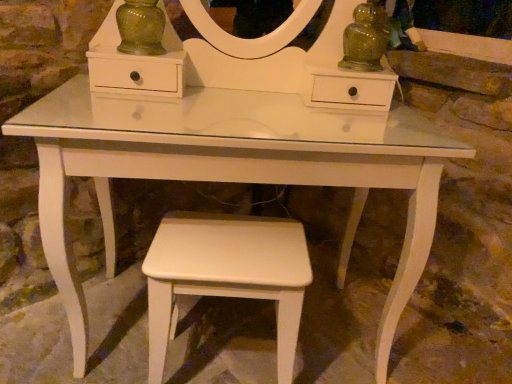
Question: Can you confirm if white matte stool at lower center is taller than green glass vase at upper left?

Choices:
 (A) yes
 (B) no

Answer: (A)

Question: Is white matte stool at lower center smaller than green glass vase at upper left?

Choices:
 (A) yes
 (B) no

Answer: (B)

Question: Is white matte stool at lower center facing towards green glass vase at upper left?

Choices:
 (A) yes
 (B) no

Answer: (B)

Question: Considering the relative positions of white matte stool at lower center and green glass vase at upper left in the image provided, is white matte stool at lower center to the left of green glass vase at upper left from the viewer's perspective?

Choices:
 (A) yes
 (B) no

Answer: (B)

Question: Does white matte stool at lower center have a greater width compared to green glass vase at upper left?

Choices:
 (A) yes
 (B) no

Answer: (A)

Question: From a real-world perspective, does white matte stool at lower center sit lower than green glass vase at upper left?

Choices:
 (A) no
 (B) yes

Answer: (B)

Question: Are green glass vase at upper left and white matte stool at lower center making contact?

Choices:
 (A) no
 (B) yes

Answer: (A)

Question: Is green glass vase at upper left aimed at white matte stool at lower center?

Choices:
 (A) yes
 (B) no

Answer: (B)

Question: From the image's perspective, would you say green glass vase at upper left is positioned over white matte stool at lower center?

Choices:
 (A) no
 (B) yes

Answer: (B)

Question: Does green glass vase at upper left have a lesser height compared to white matte stool at lower center?

Choices:
 (A) no
 (B) yes

Answer: (B)

Question: Is green glass vase at upper left not near white matte stool at lower center?

Choices:
 (A) no
 (B) yes

Answer: (A)

Question: Is green glass vase at upper left not inside white matte stool at lower center?

Choices:
 (A) yes
 (B) no

Answer: (A)

Question: Does point (279, 375) appear closer or farther from the camera than point (129, 31)?

Choices:
 (A) farther
 (B) closer

Answer: (B)